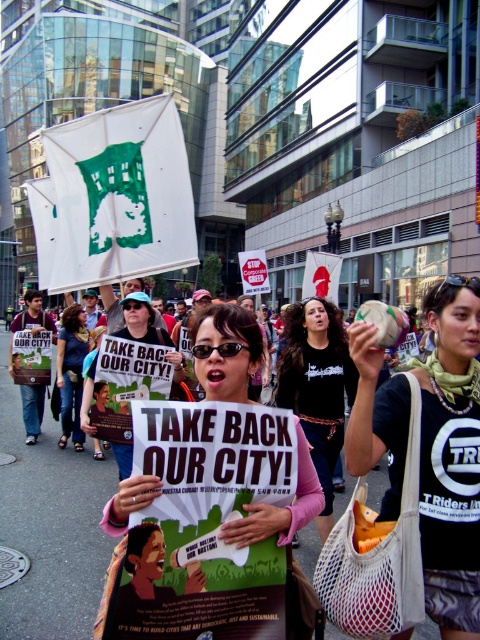
Question: Estimate the real-world distances between objects in this image. Which object is farther from the matte blue jeans at center?

Choices:
 (A) matte black sign at center
 (B) black cotton shirt at center
 (C) pink fabric shirt at center

Answer: (C)

Question: In this image, where is black mesh bag at center located relative to pink fabric shirt at center?

Choices:
 (A) right
 (B) left

Answer: (A)

Question: Does black cotton shirt at center appear over matte black sign at center?

Choices:
 (A) no
 (B) yes

Answer: (A)

Question: Does black cotton shirt at center have a greater width compared to pink fabric shirt at center?

Choices:
 (A) yes
 (B) no

Answer: (A)

Question: Which point is farther to the camera?

Choices:
 (A) black cotton shirt at center
 (B) matte black sign at center

Answer: (B)

Question: Which of these objects is positioned farthest from the matte black sign at center?

Choices:
 (A) black mesh bag at center
 (B) black cotton shirt at center
 (C) matte blue jeans at center
 (D) pink fabric shirt at center

Answer: (C)